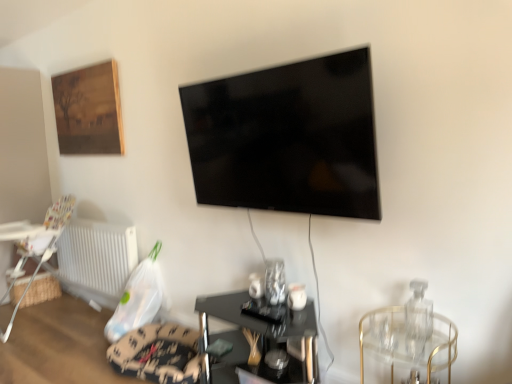
The width and height of the screenshot is (512, 384). I want to click on vacant area that is in front of woven wood table at left, marked as the 2th table in a front-to-back arrangement, so click(x=34, y=313).